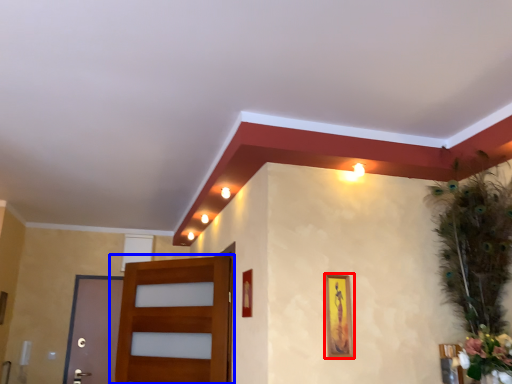
Question: Among these objects, which one is farthest to the camera, picture frame (highlighted by a red box) or door (highlighted by a blue box)?

Choices:
 (A) picture frame
 (B) door

Answer: (B)